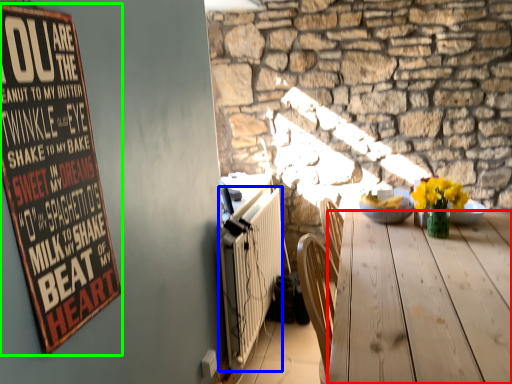
Question: Based on their relative distances, which object is nearer to desk (highlighted by a red box)? Choose from radiator (highlighted by a blue box) and bulletin board (highlighted by a green box).

Choices:
 (A) radiator
 (B) bulletin board

Answer: (A)